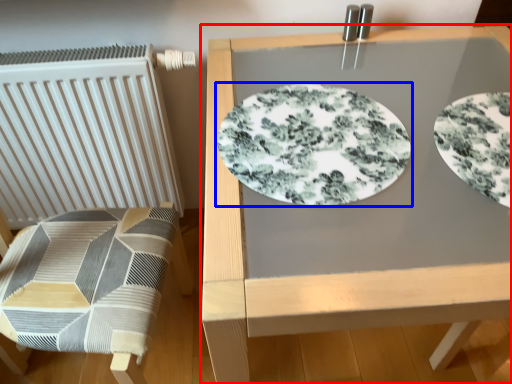
Question: Which object appears closest to the camera in this image, table (highlighted by a red box) or plate (highlighted by a blue box)?

Choices:
 (A) table
 (B) plate

Answer: (A)